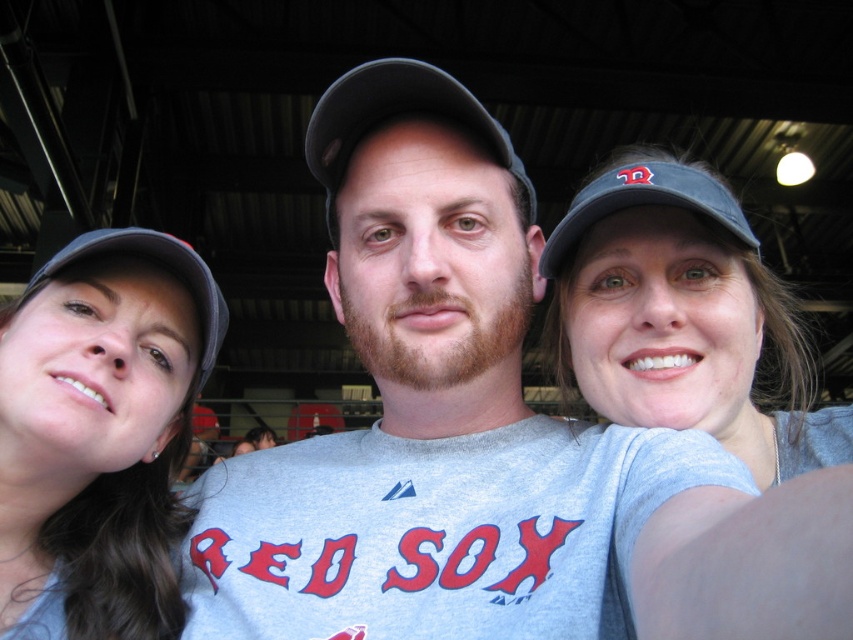
Between gray fabric cap at upper right and black fabric baseball cap at center, which one appears on the left side from the viewer's perspective?

black fabric baseball cap at center is more to the left.

Between point (601, 243) and point (526, 216), which one is positioned behind?

Positioned behind is point (526, 216).

Does point (744, 401) lie behind point (508, 161)?

No, it is in front of (508, 161).

Identify the location of gray fabric cap at upper right. (682, 316).

Who is higher up, gray matte baseball cap at center or gray fabric cap at upper left?

gray matte baseball cap at center is above.

Can you confirm if gray matte baseball cap at center is positioned above gray fabric cap at upper left?

Indeed, gray matte baseball cap at center is positioned over gray fabric cap at upper left.

The height and width of the screenshot is (640, 853). What do you see at coordinates (432, 413) in the screenshot?
I see `gray matte baseball cap at center` at bounding box center [432, 413].

Where is `gray matte baseball cap at center`? This screenshot has height=640, width=853. gray matte baseball cap at center is located at coordinates (432, 413).

Between gray fabric cap at upper left and gray fabric cap at upper right, which one appears on the right side from the viewer's perspective?

From the viewer's perspective, gray fabric cap at upper right appears more on the right side.

Is gray fabric cap at upper left further to the viewer compared to gray fabric cap at upper right?

That is True.

Who is more forward, (216, 333) or (834, 445)?

Point (834, 445) is more forward.

The height and width of the screenshot is (640, 853). Find the location of `gray fabric cap at upper left`. gray fabric cap at upper left is located at coordinates (103, 426).